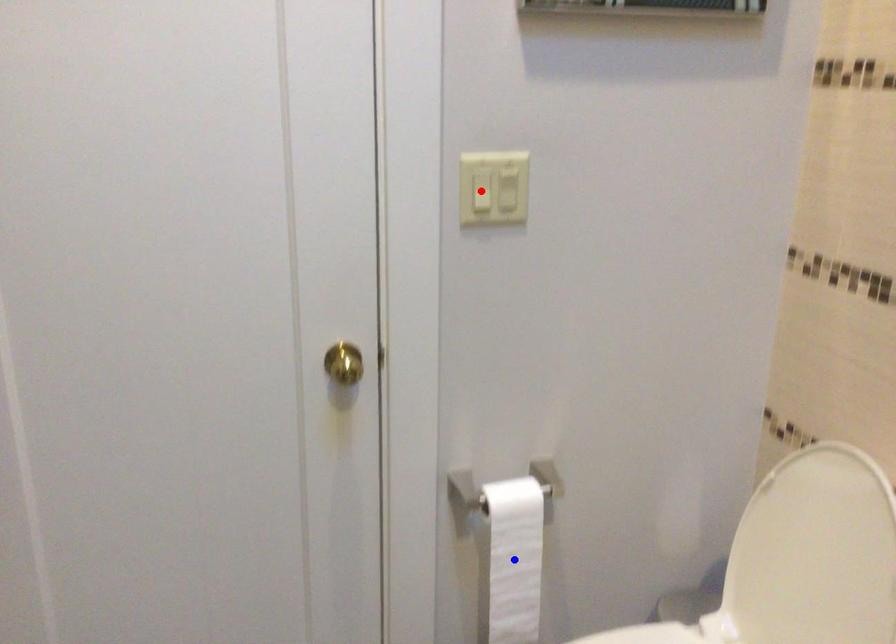
Question: Which of the two points in the image is closer to the camera?

Choices:
 (A) Blue point is closer.
 (B) Red point is closer.

Answer: (B)